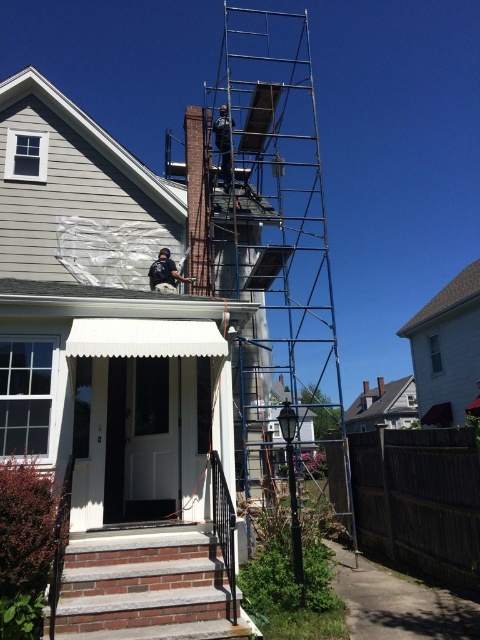
You are a delivery person with a 2.5 meter long package that needs to be carried through the path between the brick stairs at lower left and the black fabric construction worker at center. Can the package fit through the path without tilting it?

The distance between the brick stairs at lower left and the black fabric construction worker at center is 4.71 meters. Since the package is 2.5 meters long, it can fit through the path as the distance is greater than the package length.

You are a delivery person trying to reach the front door of the house. There are metallic scaffolding at center and brick stairs at lower left in your way. Which obstacle is closer to you as you approach the house?

The brick stairs at lower left is behind metallic scaffolding at center, so the metallic scaffolding at center is closer to you as you approach the house.

You are a delivery person trying to reach the front door of the house. The path to the door is blocked by the metallic scaffolding at center and the brick stairs at lower left. Which obstacle is closer to the door?

The brick stairs at lower left are closer to the door since the metallic scaffolding at center is above it, meaning the stairs are positioned lower and nearer to the entrance.